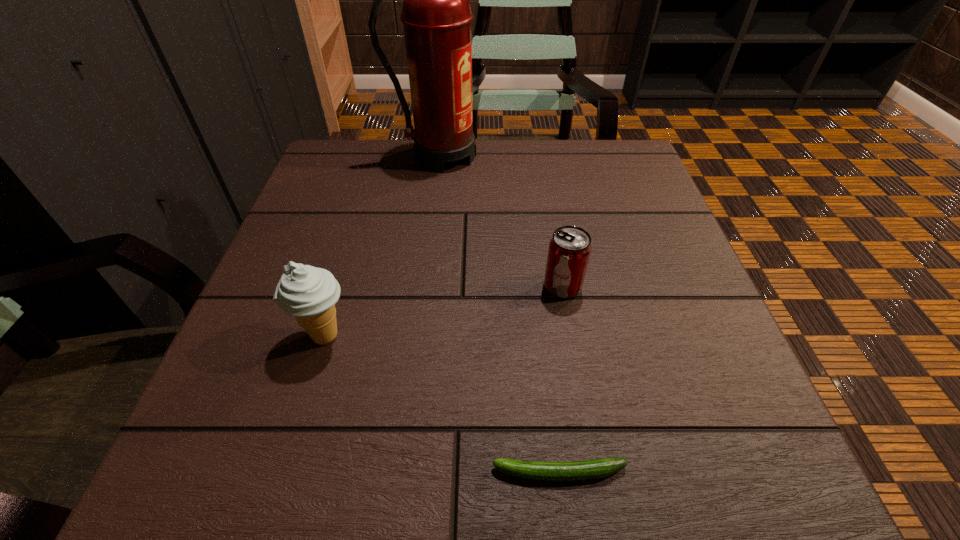
Find the location of a particular element. the farthest object is located at coordinates (436, 14).

Image resolution: width=960 pixels, height=540 pixels. Find the location of `the tallest object`. the tallest object is located at coordinates (436, 14).

The width and height of the screenshot is (960, 540). In order to click on the third shortest object in this screenshot , I will do point(309,294).

At what (x,y) coordinates should I click in order to perform the action: click on icecream. Please return your answer as a coordinate pair (x, y). This screenshot has width=960, height=540. Looking at the image, I should click on (309, 294).

Identify the location of the second farthest object. (569, 251).

This screenshot has width=960, height=540. I want to click on the second shortest object, so click(569, 251).

The image size is (960, 540). I want to click on the shortest object, so 598,468.

Find the location of a particular element. The height and width of the screenshot is (540, 960). the nearest object is located at coordinates (598, 468).

Locate an element on the screen. The image size is (960, 540). free space located on the front-facing side of the tallest object is located at coordinates (603, 156).

You are a GUI agent. You are given a task and a screenshot of the screen. Output one action in this format:
    pyautogui.click(x=<x>, y=<y>)
    Task: Click on the free space located on the back of the third farthest object
    
    Given the screenshot: What is the action you would take?
    pyautogui.click(x=369, y=191)